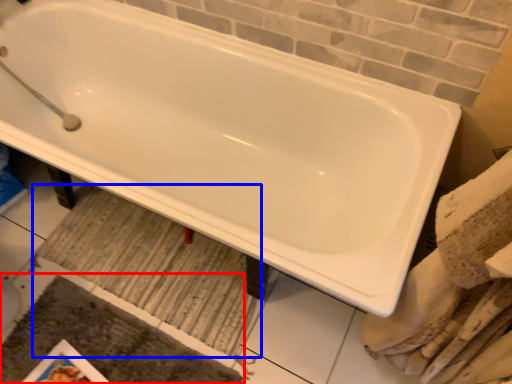
Question: Which of the following is the closest to the observer, bath mat (highlighted by a red box) or bath mat (highlighted by a blue box)?

Choices:
 (A) bath mat
 (B) bath mat

Answer: (A)